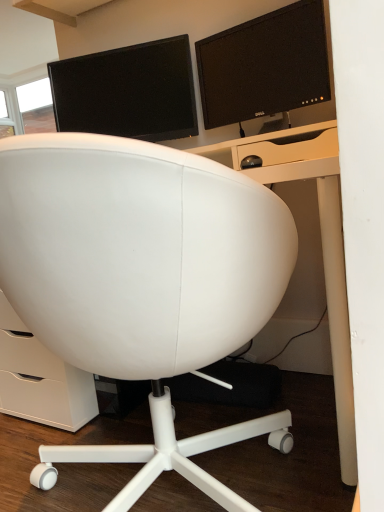
Question: Does white leather chair at center have a smaller size compared to matte black monitor at upper center, positioned as the first computer monitor in right-to-left order?

Choices:
 (A) no
 (B) yes

Answer: (A)

Question: Would you say white leather chair at center contains matte black monitor at upper center, positioned as the first computer monitor in right-to-left order?

Choices:
 (A) yes
 (B) no

Answer: (B)

Question: Is white leather chair at center facing towards matte black monitor at upper center, acting as the second computer monitor starting from the left?

Choices:
 (A) yes
 (B) no

Answer: (B)

Question: Is white leather chair at center beside matte black monitor at upper center, acting as the second computer monitor starting from the left?

Choices:
 (A) no
 (B) yes

Answer: (A)

Question: Is white leather chair at center positioned in front of matte black monitor at upper center, positioned as the first computer monitor in right-to-left order?

Choices:
 (A) no
 (B) yes

Answer: (B)

Question: Can we say white leather chair at center lies outside matte black monitor at upper center, acting as the second computer monitor starting from the left?

Choices:
 (A) no
 (B) yes

Answer: (B)

Question: From the image's perspective, is matte black monitor at upper center, positioned as the first computer monitor in right-to-left order, over white leather chair at center?

Choices:
 (A) no
 (B) yes

Answer: (B)

Question: Does matte black monitor at upper center, positioned as the first computer monitor in right-to-left order, appear on the right side of white leather chair at center?

Choices:
 (A) no
 (B) yes

Answer: (B)

Question: Considering the relative sizes of matte black monitor at upper center, positioned as the first computer monitor in right-to-left order, and white leather chair at center in the image provided, is matte black monitor at upper center, positioned as the first computer monitor in right-to-left order, wider than white leather chair at center?

Choices:
 (A) no
 (B) yes

Answer: (A)

Question: Is matte black monitor at upper center, positioned as the first computer monitor in right-to-left order, positioned before white leather chair at center?

Choices:
 (A) yes
 (B) no

Answer: (B)

Question: From the image's perspective, is matte black monitor at upper center, acting as the second computer monitor starting from the left, located beneath white leather chair at center?

Choices:
 (A) yes
 (B) no

Answer: (B)

Question: Would you consider matte black monitor at upper center, acting as the second computer monitor starting from the left, to be distant from white leather chair at center?

Choices:
 (A) yes
 (B) no

Answer: (B)

Question: From the image's perspective, is matte black monitor at upper center, which ranks as the second computer monitor in right-to-left order, located above matte black monitor at upper center, positioned as the first computer monitor in right-to-left order?

Choices:
 (A) no
 (B) yes

Answer: (A)